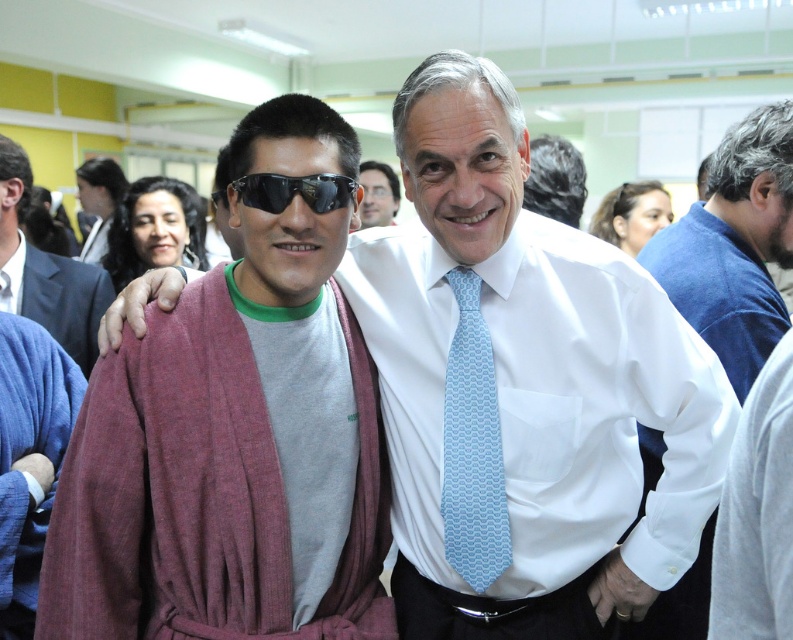
Question: Which object is positioned farthest from the maroon woolen robe at center?

Choices:
 (A) maroon textured robe at center
 (B) light blue woven tie at center
 (C) gray wool robe at center

Answer: (C)

Question: Can you confirm if gray wool robe at center is positioned above black reflective sunglasses at center?

Choices:
 (A) no
 (B) yes

Answer: (B)

Question: Among these points, which one is nearest to the camera?

Choices:
 (A) (276, 212)
 (B) (539, 161)
 (C) (496, 394)
 (D) (17, 628)

Answer: (A)

Question: Among these objects, which one is nearest to the camera?

Choices:
 (A) gray wool robe at center
 (B) maroon woolen robe at center
 (C) matte black sunglasses at upper center

Answer: (B)

Question: Does light blue woven tie at center appear on the right side of black reflective sunglasses at center?

Choices:
 (A) yes
 (B) no

Answer: (A)

Question: Can you confirm if gray wool robe at center is positioned to the right of matte black sunglasses at upper center?

Choices:
 (A) no
 (B) yes

Answer: (A)